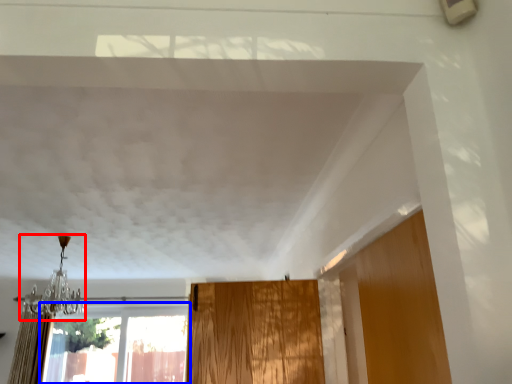
Question: Which object appears closest to the camera in this image, light fixture (highlighted by a red box) or window (highlighted by a blue box)?

Choices:
 (A) light fixture
 (B) window

Answer: (A)